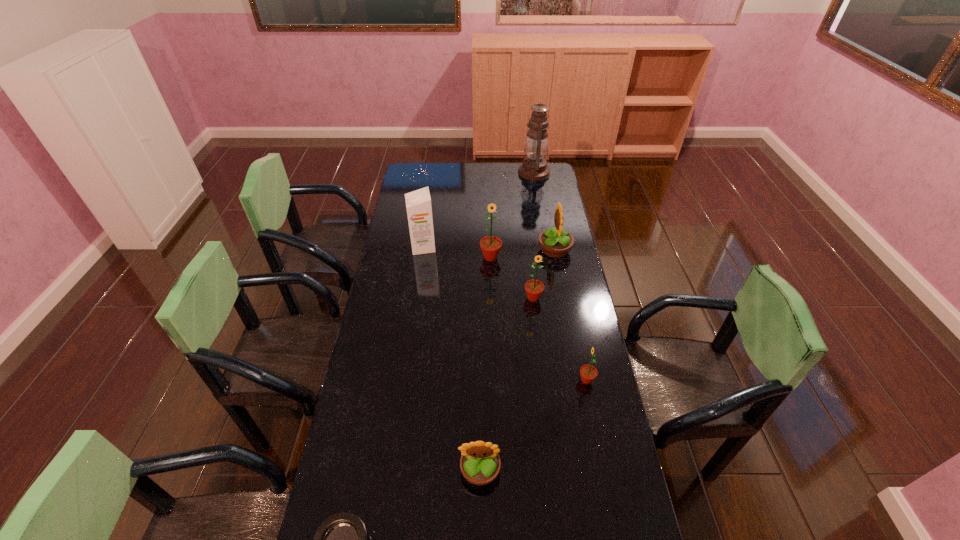
Locate an element on the screen. The width and height of the screenshot is (960, 540). the farthest object is located at coordinates (534, 167).

At what (x,y) coordinates should I click in order to perform the action: click on oil lamp. Please return your answer as a coordinate pair (x, y). Looking at the image, I should click on (534, 167).

Identify the location of the leftmost green sunflower. The height and width of the screenshot is (540, 960). pos(490,245).

Find the location of `the tallest sunflower`. the tallest sunflower is located at coordinates (490, 245).

Find the location of `carton`. carton is located at coordinates (418, 203).

The width and height of the screenshot is (960, 540). I want to click on the farther yellow sunflower, so click(x=555, y=242).

At what (x,y) coordinates should I click in order to perform the action: click on the right yellow sunflower. Please return your answer as a coordinate pair (x, y). This screenshot has height=540, width=960. Looking at the image, I should click on (555, 242).

The height and width of the screenshot is (540, 960). What are the coordinates of `the fourth nearest object` in the screenshot? It's located at (534, 288).

Identify the location of the second smallest green sunflower. This screenshot has height=540, width=960. (534, 288).

Where is `the left yellow sunflower`? The image size is (960, 540). the left yellow sunflower is located at coordinates (480, 463).